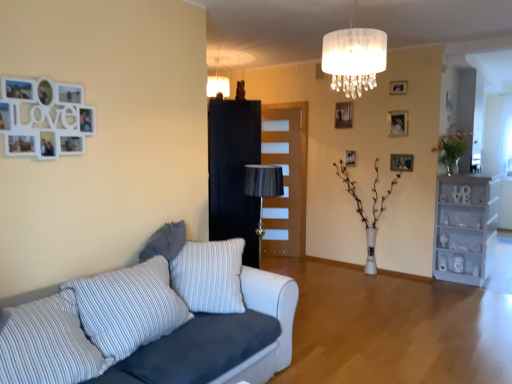
This screenshot has height=384, width=512. Describe the element at coordinates (465, 227) in the screenshot. I see `white painted wood shelf at right` at that location.

Image resolution: width=512 pixels, height=384 pixels. Describe the element at coordinates (401, 162) in the screenshot. I see `wooden picture frame at upper right, which is the 1th picture frame from right to left` at that location.

This screenshot has width=512, height=384. I want to click on gray fabric pillow at left, the first pillow from the back, so click(x=165, y=242).

Locate an element on the screen. striped fabric pillow at lower left, the first pillow from the front is located at coordinates (48, 344).

What do you see at coordinates (354, 58) in the screenshot? Image resolution: width=512 pixels, height=384 pixels. I see `white fabric chandelier at upper center, acting as the 1th lamp starting from the right` at bounding box center [354, 58].

The width and height of the screenshot is (512, 384). I want to click on matte silver picture frame at upper right, arranged as the 3th picture frame when viewed from the top, so click(398, 123).

Is wooden picture frame at center, which appears as the 2th picture frame when ordered from the bottom, oriented towards white painted wood shelf at right?

No, wooden picture frame at center, which appears as the 2th picture frame when ordered from the bottom, is not facing towards white painted wood shelf at right.

Is wooden picture frame at center, which appears as the 2th picture frame when ordered from the bottom, next to white painted wood shelf at right?

No, wooden picture frame at center, which appears as the 2th picture frame when ordered from the bottom, is not beside white painted wood shelf at right.

From the white painted wood shelf at right, count the 4th picture frame to the left and point to it. Please provide its 2D coordinates.

[(350, 158)]

Are matte silver picture frame at upper right, which is the third picture frame in bottom-to-top order, and striped fabric pillow at lower left, positioned as the 3th pillow in back-to-front order, beside each other?

They are not placed beside each other.

Does matte silver picture frame at upper right, which is the 4th picture frame from left to right, have a lesser width compared to striped fabric pillow at lower left, the first pillow from the front?

Yes.

Is matte silver picture frame at upper right, the second picture frame viewed from the right, outside of striped fabric pillow at lower left, the first pillow from the front?

Absolutely, matte silver picture frame at upper right, the second picture frame viewed from the right, is external to striped fabric pillow at lower left, the first pillow from the front.

Is matte silver picture frame at upper right, which is the 4th picture frame from left to right, oriented towards striped fabric pillow at lower left, positioned as the 3th pillow in back-to-front order?

Yes, matte silver picture frame at upper right, which is the 4th picture frame from left to right, faces towards striped fabric pillow at lower left, positioned as the 3th pillow in back-to-front order.

Who is taller, brown wooden door at center or wooden picture frame at upper center, placed as the first picture frame when sorted from top to bottom?

brown wooden door at center.

Is brown wooden door at center not inside wooden picture frame at upper center, acting as the third picture frame starting from the left?

Indeed, brown wooden door at center is completely outside wooden picture frame at upper center, acting as the third picture frame starting from the left.

From the image's perspective, is brown wooden door at center located beneath wooden picture frame at upper center, which ranks as the fifth picture frame in bottom-to-top order?

Correct, brown wooden door at center appears lower than wooden picture frame at upper center, which ranks as the fifth picture frame in bottom-to-top order, in the image.

Does white fabric chandelier at upper center, which ranks as the first lamp in bottom-to-top order, contain wooden picture frame at center, the fourth picture frame from the top?

No, wooden picture frame at center, the fourth picture frame from the top, is not a part of white fabric chandelier at upper center, which ranks as the first lamp in bottom-to-top order.

Is white fabric chandelier at upper center, which ranks as the first lamp in bottom-to-top order, oriented away from wooden picture frame at center, arranged as the fourth picture frame when viewed from the right?

No.

In the scene shown: Which of these two, white fabric chandelier at upper center, the second lamp viewed from the left, or wooden picture frame at center, the fourth picture frame from the top, stands taller?

white fabric chandelier at upper center, the second lamp viewed from the left, is taller.

In terms of size, does white fabric chandelier at upper center, the second lamp viewed from the left, appear bigger or smaller than wooden picture frame at center, arranged as the fourth picture frame when viewed from the right?

In the image, white fabric chandelier at upper center, the second lamp viewed from the left, appears to be larger than wooden picture frame at center, arranged as the fourth picture frame when viewed from the right.

Is point (489, 235) in front of point (222, 81)?

Yes, point (489, 235) is in front of point (222, 81).

Find the location of a particular element. lamp behind the white painted wood shelf at right is located at coordinates (218, 84).

Are white painted wood shelf at right and matte white lampshade at upper center, which appears as the second lamp when viewed from the front, making contact?

white painted wood shelf at right and matte white lampshade at upper center, which appears as the second lamp when viewed from the front, are not in contact.

From a real-world perspective, is white painted wood shelf at right physically located above or below matte white lampshade at upper center, the second lamp positioned from the right?

Clearly, from a real-world perspective, white painted wood shelf at right is below matte white lampshade at upper center, the second lamp positioned from the right.

From a real-world perspective, which is physically below, translucent glass vase at right, which appears as the second plant when viewed from the left, or matte silver picture frame at upper center, which is the 2th picture frame in top-to-bottom order?

translucent glass vase at right, which appears as the second plant when viewed from the left, from a real-world perspective.

Which object is positioned more to the right, translucent glass vase at right, which is the 2th plant in bottom-to-top order, or matte silver picture frame at upper center, the fifth picture frame viewed from the right?

translucent glass vase at right, which is the 2th plant in bottom-to-top order.

Does translucent glass vase at right, marked as the 1th plant in a top-to-bottom arrangement, have a greater height compared to matte silver picture frame at upper center, which is the 2th picture frame in top-to-bottom order?

Indeed, translucent glass vase at right, marked as the 1th plant in a top-to-bottom arrangement, has a greater height compared to matte silver picture frame at upper center, which is the 2th picture frame in top-to-bottom order.

In the image, is white fabric chandelier at upper center, placed as the second lamp when sorted from back to front, positioned in front of or behind wooden picture frame at upper center, placed as the first picture frame when sorted from top to bottom?

In the image, white fabric chandelier at upper center, placed as the second lamp when sorted from back to front, appears in front of wooden picture frame at upper center, placed as the first picture frame when sorted from top to bottom.

From the image's perspective, is white fabric chandelier at upper center, placed as the second lamp when sorted from back to front, beneath wooden picture frame at upper center, acting as the third picture frame starting from the left?

Indeed, from the image's perspective, white fabric chandelier at upper center, placed as the second lamp when sorted from back to front, is shown beneath wooden picture frame at upper center, acting as the third picture frame starting from the left.

Looking at this image, from a real-world perspective, is white fabric chandelier at upper center, acting as the 1th lamp starting from the right, located beneath wooden picture frame at upper center, which ranks as the 3th picture frame in right-to-left order?

Actually, white fabric chandelier at upper center, acting as the 1th lamp starting from the right, is physically above wooden picture frame at upper center, which ranks as the 3th picture frame in right-to-left order, in the real world.

There is a white painted wood shelf at right. At what (x,y) coordinates should I click in order to perform the action: click on the 2nd picture frame above it (from the image's perspective). Please return your answer as a coordinate pair (x, y). Looking at the image, I should click on (350, 158).

Image resolution: width=512 pixels, height=384 pixels. There is a matte silver picture frame at upper right, which is the third picture frame in bottom-to-top order. Identify the location of the 3rd pillow below it (from a real-world perspective). (48, 344).

When comparing their distances from striped fabric pillow at lower left, arranged as the second pillow when viewed from the front, does white fabric chandelier at upper center, placed as the second lamp when sorted from back to front, or matte silver picture frame at upper right, which is the 4th picture frame from left to right, seem further?

The object further to striped fabric pillow at lower left, arranged as the second pillow when viewed from the front, is matte silver picture frame at upper right, which is the 4th picture frame from left to right.

Which object lies further to the anchor point white fabric couch at lower left, wooden picture frame at center, arranged as the fourth picture frame when viewed from the right, or white painted wood shelf at right?

wooden picture frame at center, arranged as the fourth picture frame when viewed from the right.

Which object lies nearer to the anchor point matte white lampshade at upper center, which appears as the second lamp when viewed from the front, wooden picture frame at upper center, placed as the first picture frame when sorted from top to bottom, or wooden picture frame at center, which appears as the 2th picture frame when ordered from the bottom?

The object closer to matte white lampshade at upper center, which appears as the second lamp when viewed from the front, is wooden picture frame at center, which appears as the 2th picture frame when ordered from the bottom.

Which object lies further to the anchor point matte white lampshade at upper center, which ranks as the second lamp in bottom-to-top order, white glossy vase at center, which ranks as the first plant in bottom-to-top order, or black glossy armoire at center?

white glossy vase at center, which ranks as the first plant in bottom-to-top order, is positioned further to the anchor matte white lampshade at upper center, which ranks as the second lamp in bottom-to-top order.

From the image, which object appears to be farther from wooden picture frame at upper center, acting as the third picture frame starting from the left, matte silver picture frame at upper center, the fifth picture frame viewed from the right, or matte white lampshade at upper center, the second lamp positioned from the right?

Based on the image, matte white lampshade at upper center, the second lamp positioned from the right, appears to be further to wooden picture frame at upper center, acting as the third picture frame starting from the left.

Estimate the real-world distances between objects in this image. Which object is further from matte silver picture frame at upper center, the 1th picture frame positioned from the left, wooden picture frame at center, the fourth picture frame from the top, or wooden picture frame at upper right, marked as the 1th picture frame in a bottom-to-top arrangement?

wooden picture frame at upper right, marked as the 1th picture frame in a bottom-to-top arrangement, is further to matte silver picture frame at upper center, the 1th picture frame positioned from the left.

Which object lies further to the anchor point matte silver picture frame at upper right, the second picture frame viewed from the right, matte white lampshade at upper center, the 1th lamp positioned from the left, or striped fabric pillow at lower left, positioned as the 3th pillow in back-to-front order?

The object further to matte silver picture frame at upper right, the second picture frame viewed from the right, is striped fabric pillow at lower left, positioned as the 3th pillow in back-to-front order.

Looking at the image, which one is located further to white fabric couch at lower left, wooden picture frame at center, arranged as the fourth picture frame when viewed from the right, or striped fabric pillow at lower left, arranged as the second pillow when viewed from the front?

wooden picture frame at center, arranged as the fourth picture frame when viewed from the right, lies further to white fabric couch at lower left than the other object.

Identify the location of armoire between gray fabric pillow at left, the first pillow from the back, and matte silver picture frame at upper center, the fifth picture frame viewed from the right, along the z-axis. (233, 172).

Identify the location of plant between gray fabric pillow at left, the first pillow from the back, and translucent glass vase at right, marked as the 1th plant in a top-to-bottom arrangement, in the horizontal direction. The height and width of the screenshot is (384, 512). (362, 211).

In order to click on armoire between gray fabric pillow at left, marked as the third pillow in a front-to-back arrangement, and matte silver picture frame at upper right, which is the third picture frame in bottom-to-top order, in the horizontal direction in this screenshot , I will do (x=233, y=172).

The height and width of the screenshot is (384, 512). I want to click on plant that lies between matte silver picture frame at upper right, which is the 4th picture frame from left to right, and white glossy vase at center, marked as the 1th plant in a left-to-right arrangement, from top to bottom, so click(x=451, y=150).